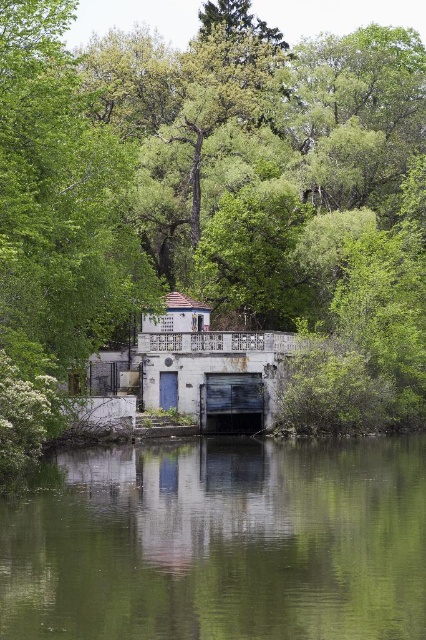
Question: Does green leafy tree at center have a greater width compared to green reflective water at center?

Choices:
 (A) no
 (B) yes

Answer: (B)

Question: Can you confirm if green leafy tree at center is thinner than green reflective water at center?

Choices:
 (A) yes
 (B) no

Answer: (B)

Question: Which object is farther from the camera taking this photo?

Choices:
 (A) green leafy tree at center
 (B) green reflective water at center

Answer: (A)

Question: Which point is closer to the camera?

Choices:
 (A) (14, 172)
 (B) (213, 518)

Answer: (B)

Question: Does green leafy tree at center have a larger size compared to green reflective water at center?

Choices:
 (A) yes
 (B) no

Answer: (A)